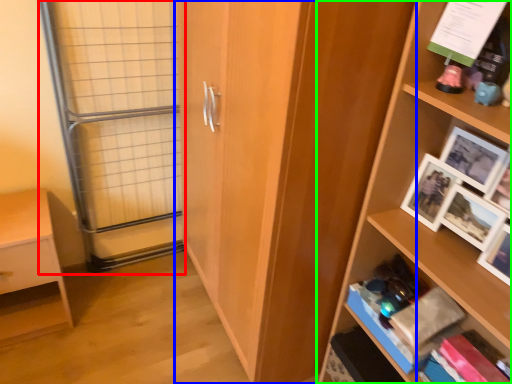
Question: Which is nearer to the glass door (highlighted by a red box)? cupboard (highlighted by a blue box) or shelf (highlighted by a green box).

Choices:
 (A) cupboard
 (B) shelf

Answer: (A)